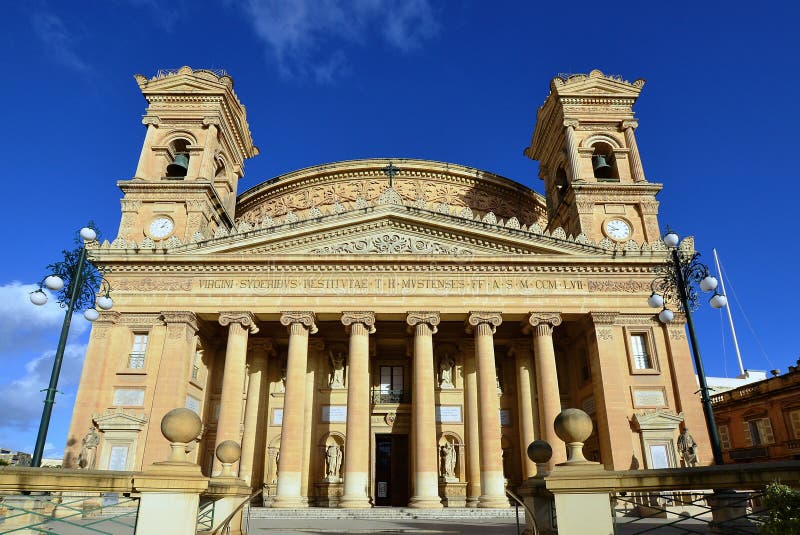
The image size is (800, 535). In order to click on round pillars in this screenshot , I will do `click(496, 475)`, `click(428, 468)`, `click(349, 467)`, `click(300, 473)`.